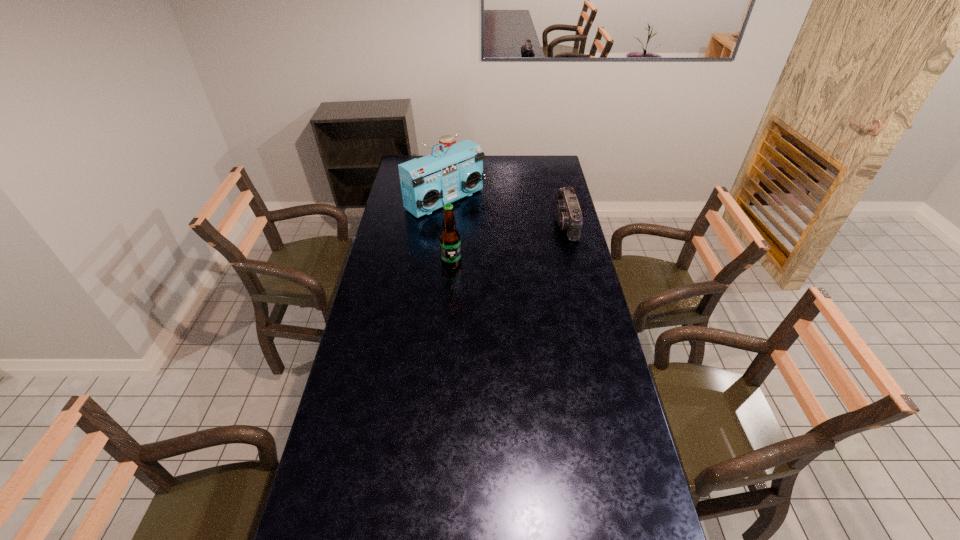
Where is `free space that satisfies the following two spatial constraints: 1. on the front side of the radio receiver; 2. on the front-facing side of the camcorder`? The image size is (960, 540). free space that satisfies the following two spatial constraints: 1. on the front side of the radio receiver; 2. on the front-facing side of the camcorder is located at coordinates (443, 224).

What are the coordinates of `free space in the image that satisfies the following two spatial constraints: 1. on the front side of the can; 2. on the right side of the radio receiver` in the screenshot? It's located at (444, 200).

You are a GUI agent. You are given a task and a screenshot of the screen. Output one action in this format:
    pyautogui.click(x=<x>, y=<y>)
    Task: Click on the vacant area in the image that satisfies the following two spatial constraints: 1. on the front side of the rightmost object; 2. on the front-facing side of the farthest object
    
    Given the screenshot: What is the action you would take?
    pyautogui.click(x=443, y=224)

Find the location of a particular element. Image resolution: width=960 pixels, height=540 pixels. vacant region that satisfies the following two spatial constraints: 1. on the front side of the radio receiver; 2. on the front-facing side of the camcorder is located at coordinates (443, 224).